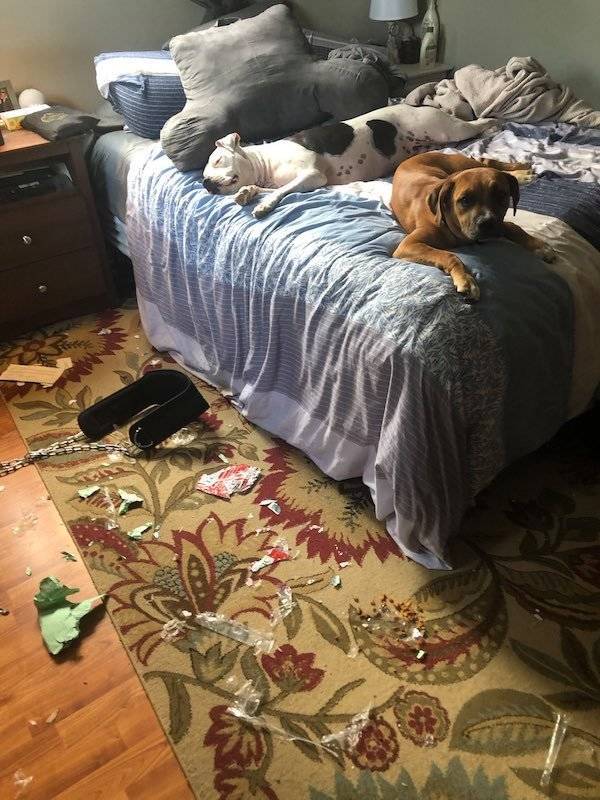
Where is `rug`? This screenshot has height=800, width=600. rug is located at coordinates (197, 706).